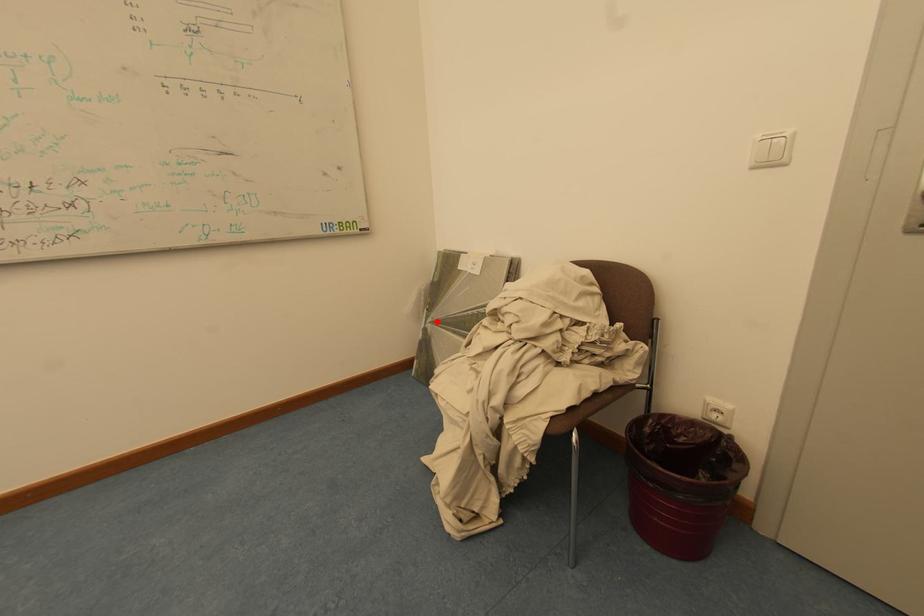
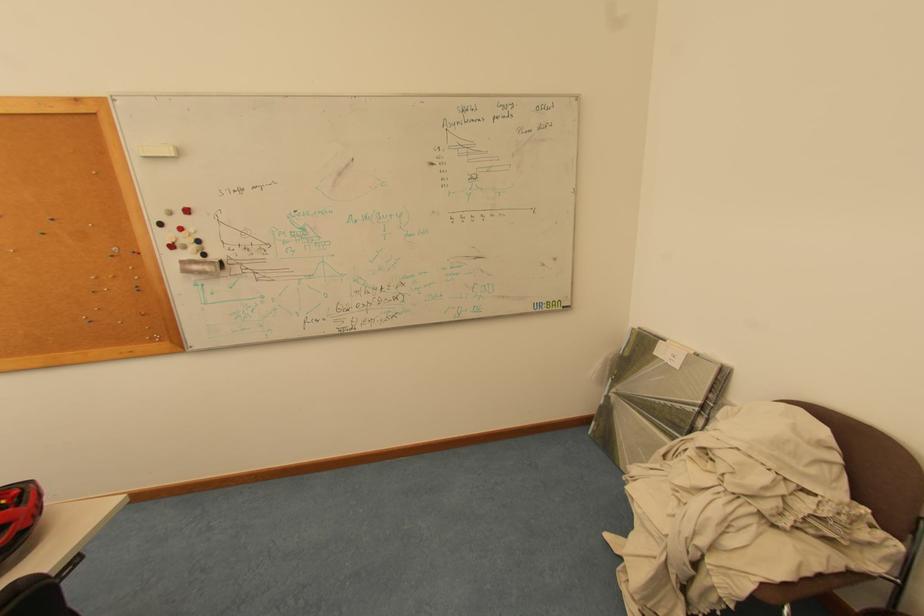
Find the pixel in the second image that matches the highlighted location in the first image.

(622, 392)